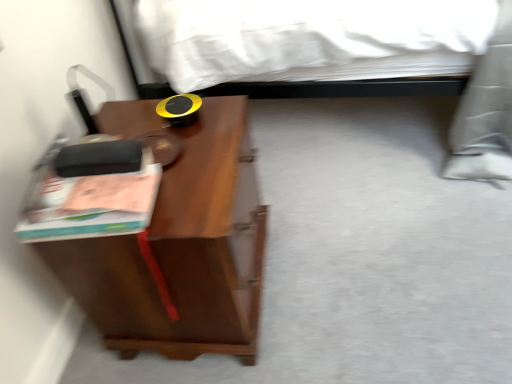
Locate an element on the screen. The width and height of the screenshot is (512, 384). vacant area on top of matte pink paperback book at left (from a real-world perspective) is located at coordinates (92, 155).